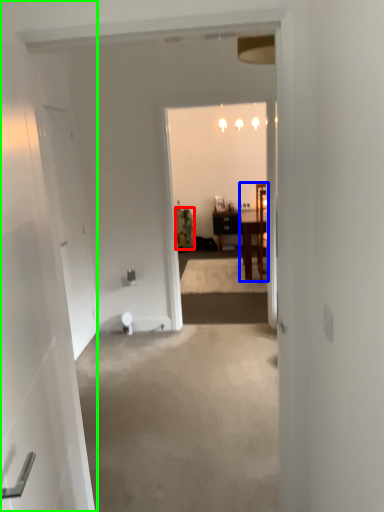
Question: Which object is the farthest from houseplant (highlighted by a red box)? Choose among these: chair (highlighted by a blue box) or door (highlighted by a green box).

Choices:
 (A) chair
 (B) door

Answer: (B)